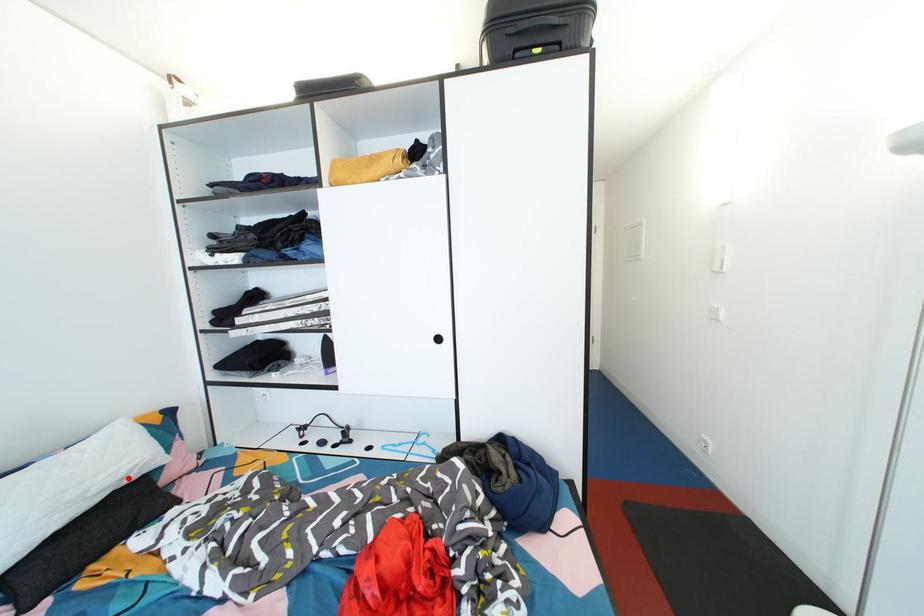
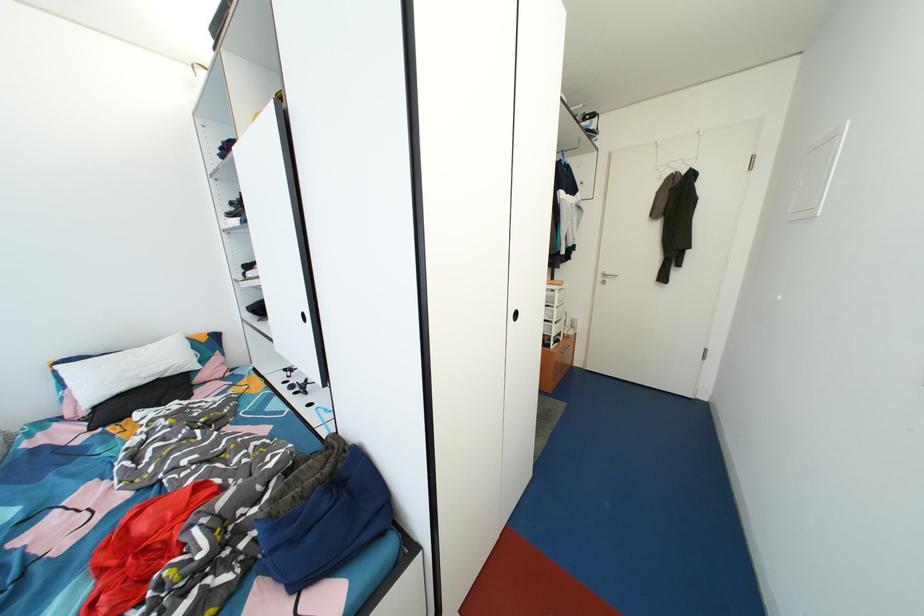
The point at the highlighted location is marked in the first image. Where is the corresponding point in the second image?

(167, 373)